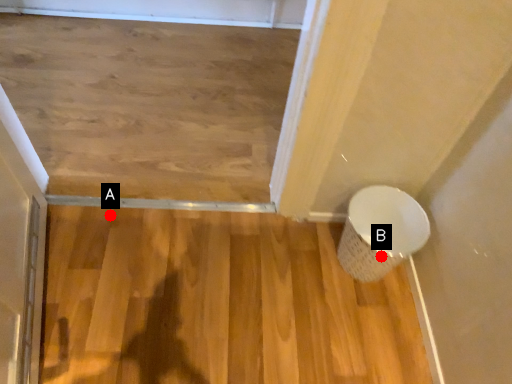
Question: Two points are circled on the image, labeled by A and B beside each circle. Which of the following is the closest to the observer?

Choices:
 (A) A is closer
 (B) B is closer

Answer: (B)